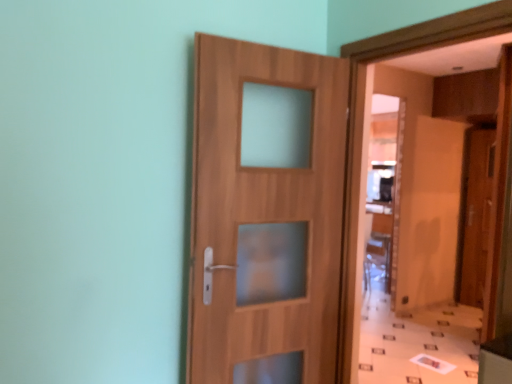
Locate an element on the screen. wooden door at right, the 1th door viewed from the right is located at coordinates (475, 215).

What do you see at coordinates (475, 215) in the screenshot? I see `wooden door at right, the second door in the left-to-right sequence` at bounding box center [475, 215].

Measure the distance between point (208, 379) and camera.

Point (208, 379) and camera are 5.73 feet apart.

What is the approximate height of wooden door at center, which is the 2th door from right to left?

wooden door at center, which is the 2th door from right to left, is 1.52 meters tall.

This screenshot has height=384, width=512. What do you see at coordinates (266, 213) in the screenshot?
I see `wooden door at center, the 1th door positioned from the front` at bounding box center [266, 213].

This screenshot has width=512, height=384. I want to click on wooden door at center, which ranks as the 2th door in back-to-front order, so click(266, 213).

The image size is (512, 384). In order to click on wooden door at right, the second door in the left-to-right sequence in this screenshot , I will do `click(475, 215)`.

Which object is positioned more to the left, wooden door at center, which ranks as the 2th door in back-to-front order, or wooden door at right, marked as the second door in a front-to-back arrangement?

wooden door at center, which ranks as the 2th door in back-to-front order.

Which is behind, wooden door at center, the 1th door positioned from the front, or wooden door at right, the 1th door viewed from the right?

wooden door at right, the 1th door viewed from the right, is behind.

Considering the points (264, 123) and (464, 177), which point is in front, point (264, 123) or point (464, 177)?

The point (264, 123) is in front.

From the image's perspective, between wooden door at center, which is the 2th door from right to left, and wooden door at right, which is the 1th door in back-to-front order, which one is located above?

From the image's view, wooden door at center, which is the 2th door from right to left, is above.

From a real-world perspective, is wooden door at center, the 1th door positioned from the front, under wooden door at right, marked as the second door in a front-to-back arrangement?

No, from a real-world perspective, wooden door at center, the 1th door positioned from the front, is not under wooden door at right, marked as the second door in a front-to-back arrangement.

Which object is wider, wooden door at center, which is the first door from left to right, or wooden door at right, the second door in the left-to-right sequence?

With larger width is wooden door at right, the second door in the left-to-right sequence.

Considering the sizes of objects wooden door at center, which is the 2th door from right to left, and wooden door at right, which is the 1th door in back-to-front order, in the image provided, who is taller, wooden door at center, which is the 2th door from right to left, or wooden door at right, which is the 1th door in back-to-front order,?

wooden door at right, which is the 1th door in back-to-front order, is taller.

Based on their sizes in the image, would you say wooden door at center, which ranks as the 2th door in back-to-front order, is bigger or smaller than wooden door at right, marked as the second door in a front-to-back arrangement?

Considering their sizes, wooden door at center, which ranks as the 2th door in back-to-front order, takes up less space than wooden door at right, marked as the second door in a front-to-back arrangement.

Consider the image. Could wooden door at right, the second door in the left-to-right sequence, be considered to be inside wooden door at center, which is the 2th door from right to left?

Actually, wooden door at right, the second door in the left-to-right sequence, is outside wooden door at center, which is the 2th door from right to left.

Does wooden door at center, the 1th door positioned from the front, touch wooden door at right, marked as the second door in a front-to-back arrangement?

There is a gap between wooden door at center, the 1th door positioned from the front, and wooden door at right, marked as the second door in a front-to-back arrangement.

Is wooden door at center, which is the 2th door from right to left, looking in the opposite direction of wooden door at right, the 1th door viewed from the right?

wooden door at center, which is the 2th door from right to left, is not turned away from wooden door at right, the 1th door viewed from the right.

How different are the orientations of wooden door at center, which is the first door from left to right, and wooden door at right, which is the 1th door in back-to-front order, in degrees?

wooden door at center, which is the first door from left to right, and wooden door at right, which is the 1th door in back-to-front order, are facing 67.1 degrees away from each other.

Could you measure the distance between wooden door at center, which is the first door from left to right, and wooden door at right, the second door in the left-to-right sequence?

3.32 meters.

The height and width of the screenshot is (384, 512). I want to click on door above the wooden door at right, which is the 1th door in back-to-front order (from a real-world perspective), so 266,213.

Would you say wooden door at right, the second door in the left-to-right sequence, is to the left or to the right of wooden door at center, which ranks as the 2th door in back-to-front order, in the picture?

wooden door at right, the second door in the left-to-right sequence, is to the right of wooden door at center, which ranks as the 2th door in back-to-front order.

Which object is more forward, wooden door at right, which is the 1th door in back-to-front order, or wooden door at center, which is the first door from left to right?

wooden door at center, which is the first door from left to right.

Considering the points (483, 131) and (201, 377), which point is behind, point (483, 131) or point (201, 377)?

The point (483, 131) is farther.

From the image's perspective, does wooden door at right, which is the 1th door in back-to-front order, appear lower than wooden door at center, which ranks as the 2th door in back-to-front order?

Yes, from the image's perspective, wooden door at right, which is the 1th door in back-to-front order, is below wooden door at center, which ranks as the 2th door in back-to-front order.

From a real-world perspective, between wooden door at right, marked as the second door in a front-to-back arrangement, and wooden door at center, which is the 2th door from right to left, who is vertically higher?

In real-world perspective, wooden door at center, which is the 2th door from right to left, is above.

Which object is thinner, wooden door at right, marked as the second door in a front-to-back arrangement, or wooden door at center, which is the 2th door from right to left?

Thinner between the two is wooden door at center, which is the 2th door from right to left.

Between wooden door at right, which is the 1th door in back-to-front order, and wooden door at center, which is the first door from left to right, which one has more height?

wooden door at right, which is the 1th door in back-to-front order, is taller.

Consider the image. Is wooden door at right, the 1th door viewed from the right, bigger than wooden door at center, which ranks as the 2th door in back-to-front order?

Correct, wooden door at right, the 1th door viewed from the right, is larger in size than wooden door at center, which ranks as the 2th door in back-to-front order.

Based on the photo, is wooden door at right, the second door in the left-to-right sequence, inside or outside of wooden door at center, the 1th door positioned from the front?

wooden door at right, the second door in the left-to-right sequence, is not enclosed by wooden door at center, the 1th door positioned from the front.

Is wooden door at right, the second door in the left-to-right sequence, not close to wooden door at center, which is the first door from left to right?

Yes, wooden door at right, the second door in the left-to-right sequence, and wooden door at center, which is the first door from left to right, are located far from each other.

Is wooden door at right, which is the 1th door in back-to-front order, oriented towards wooden door at center, which is the first door from left to right?

Yes, wooden door at right, which is the 1th door in back-to-front order, is turned towards wooden door at center, which is the first door from left to right.

How different are the orientations of wooden door at right, marked as the second door in a front-to-back arrangement, and wooden door at center, which ranks as the 2th door in back-to-front order, in degrees?

There is a 67.1-degree angle between the facing directions of wooden door at right, marked as the second door in a front-to-back arrangement, and wooden door at center, which ranks as the 2th door in back-to-front order.

Could you measure the distance between wooden door at right, which is the 1th door in back-to-front order, and wooden door at center, the 1th door positioned from the front?

wooden door at right, which is the 1th door in back-to-front order, and wooden door at center, the 1th door positioned from the front, are 3.32 meters apart.

Image resolution: width=512 pixels, height=384 pixels. In order to click on door that is behind the wooden door at center, which is the first door from left to right in this screenshot , I will do `click(475, 215)`.

I want to click on door that appears behind the wooden door at center, which ranks as the 2th door in back-to-front order, so click(x=475, y=215).

Find the location of `door located above the wooden door at right, the 1th door viewed from the right (from the image's perspective)`. door located above the wooden door at right, the 1th door viewed from the right (from the image's perspective) is located at coordinates (266, 213).